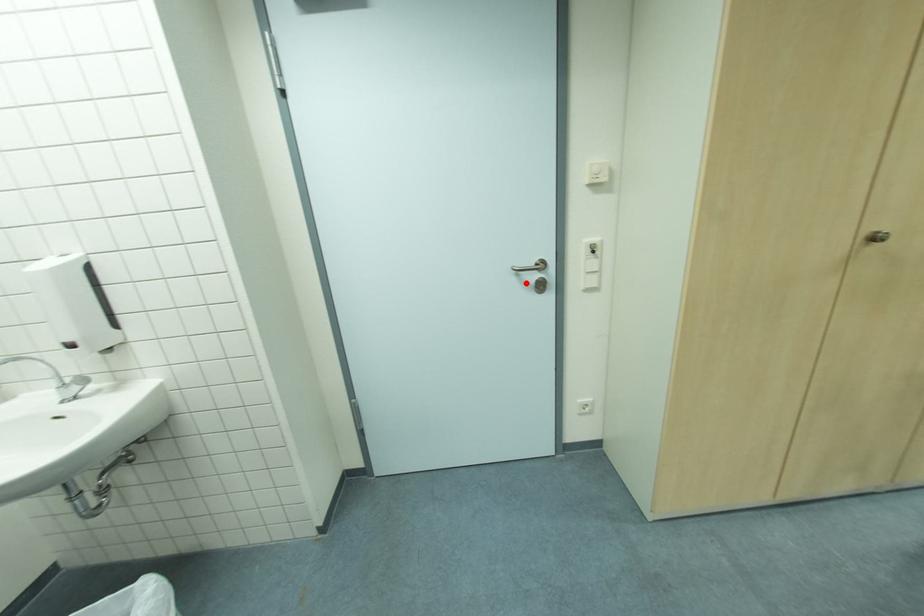
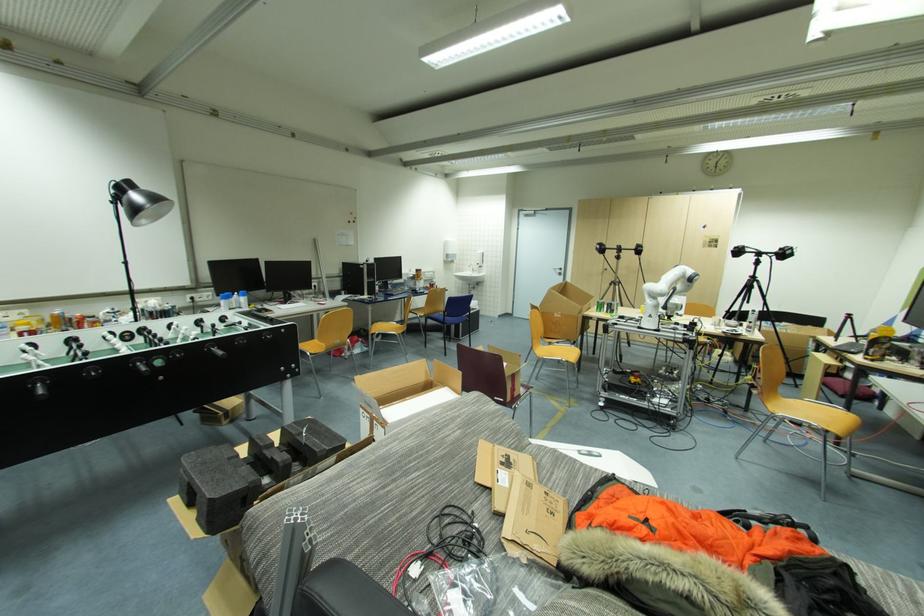
The point at the highlighted location is marked in the first image. Where is the corresponding point in the second image?

(560, 273)